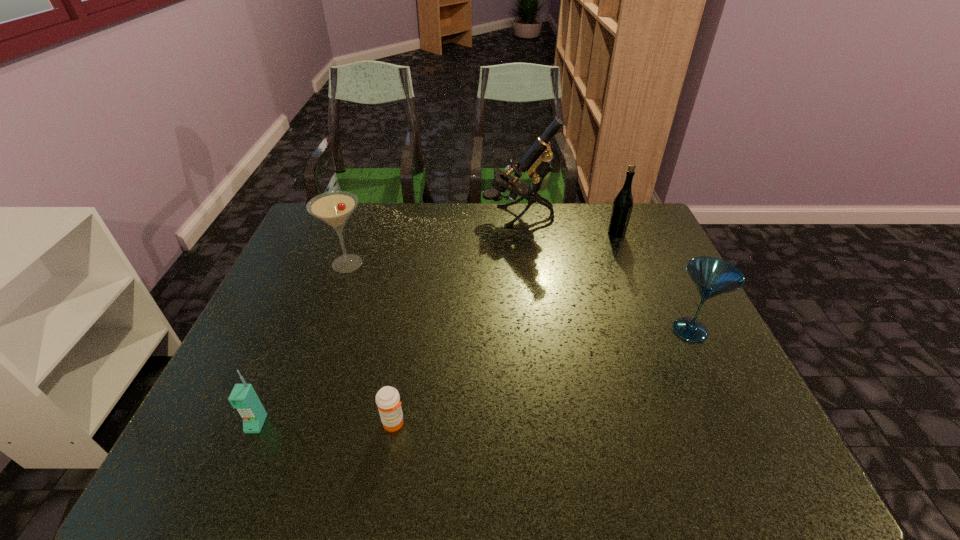
This screenshot has height=540, width=960. Identify the location of object that stands as the fourth closest to the fourth object from right to left. [536, 161].

The image size is (960, 540). Identify the location of the closest object to the tallest object. (622, 207).

At what (x,y) coordinates should I click in order to perform the action: click on vacant space that satisfies the following two spatial constraints: 1. on the back side of the right martini; 2. through the eyepiece of the farthest object. Please return your answer as a coordinate pair (x, y). The width and height of the screenshot is (960, 540). Looking at the image, I should click on (635, 217).

You are a GUI agent. You are given a task and a screenshot of the screen. Output one action in this format:
    pyautogui.click(x=<x>, y=<y>)
    Task: Click on the vacant space that satisfies the following two spatial constraints: 1. on the back side of the beer bottle; 2. through the eyepiece of the fourth object from left to right
    The height and width of the screenshot is (540, 960).
    Given the screenshot: What is the action you would take?
    pyautogui.click(x=610, y=217)

Find the location of a particular element. This screenshot has width=960, height=540. vacant area that satisfies the following two spatial constraints: 1. through the eyepiece of the third object from right to left; 2. on the front side of the left martini is located at coordinates (523, 264).